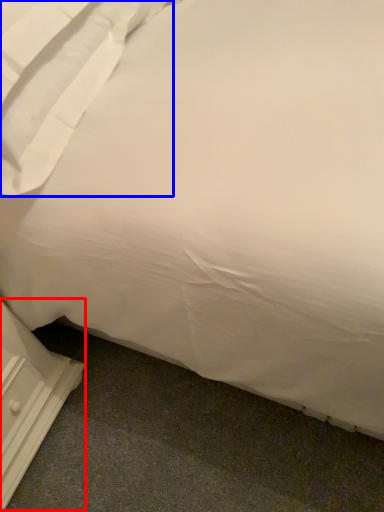
Question: Which object is closer to the camera taking this photo, dresser (highlighted by a red box) or pillow (highlighted by a blue box)?

Choices:
 (A) dresser
 (B) pillow

Answer: (B)